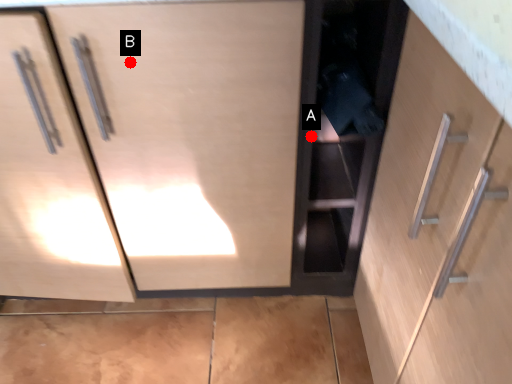
Question: Two points are circled on the image, labeled by A and B beside each circle. Among these points, which one is nearest to the camera?

Choices:
 (A) A is closer
 (B) B is closer

Answer: (B)